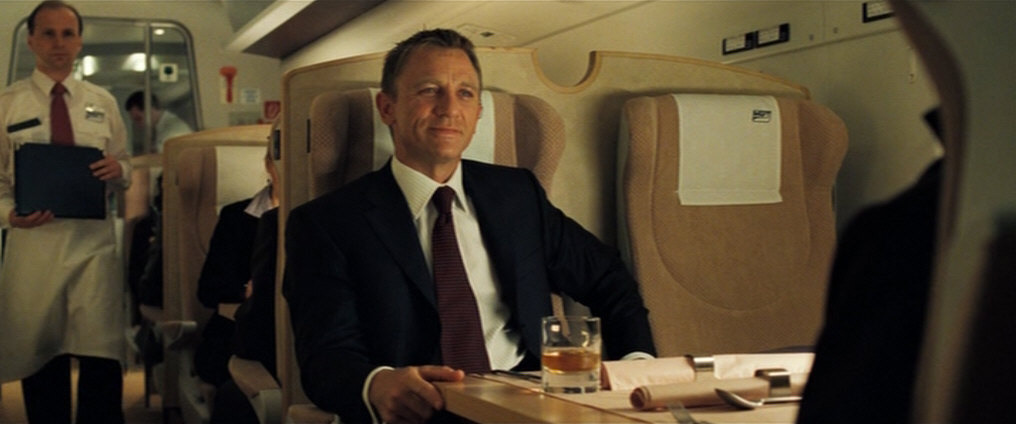
I want to click on seat, so click(707, 151), click(525, 145), click(241, 176).